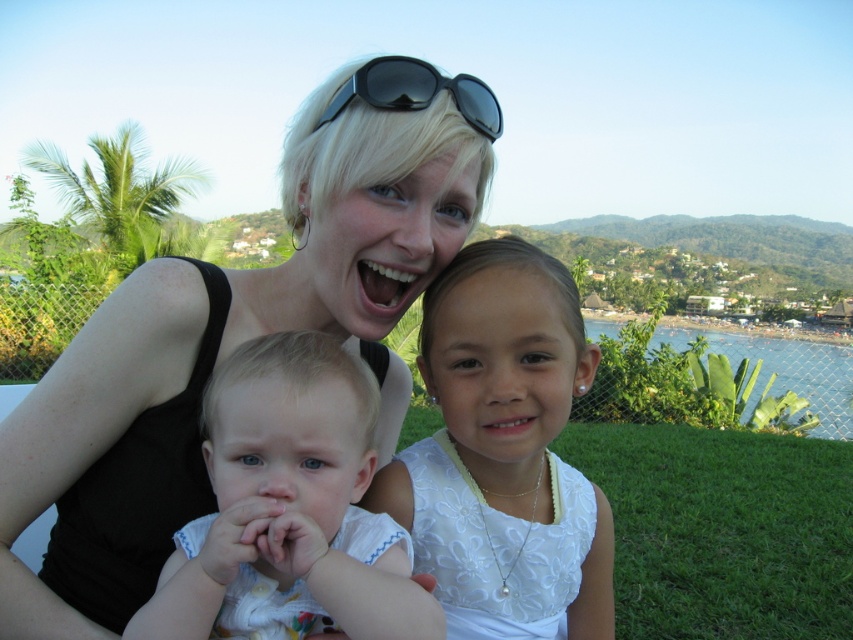
Question: Among these points, which one is nearest to the camera?

Choices:
 (A) (476, 540)
 (B) (250, 513)
 (C) (341, 97)

Answer: (B)

Question: Which point is farther from the camera taking this photo?

Choices:
 (A) (680, 636)
 (B) (13, 464)
 (C) (337, 388)
 (D) (450, 86)

Answer: (A)

Question: Does light blue fabric baby at center appear on the left side of black plastic sunglasses at upper center?

Choices:
 (A) yes
 (B) no

Answer: (A)

Question: Does matte black tank top at center have a smaller size compared to green grass at lower right?

Choices:
 (A) yes
 (B) no

Answer: (A)

Question: Considering the relative positions of light blue fabric baby at center and green grass at lower right in the image provided, where is light blue fabric baby at center located with respect to green grass at lower right?

Choices:
 (A) right
 (B) left

Answer: (B)

Question: Estimate the real-world distances between objects in this image. Which object is closer to the white lace dress at center?

Choices:
 (A) black plastic sunglasses at upper center
 (B) matte black tank top at center

Answer: (B)